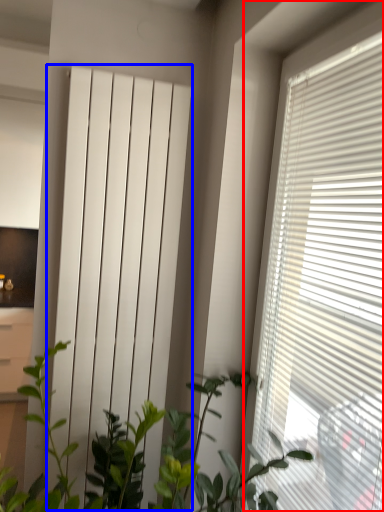
Question: Which of the following is the farthest to the observer, window blind (highlighted by a red box) or curtain (highlighted by a blue box)?

Choices:
 (A) window blind
 (B) curtain

Answer: (B)